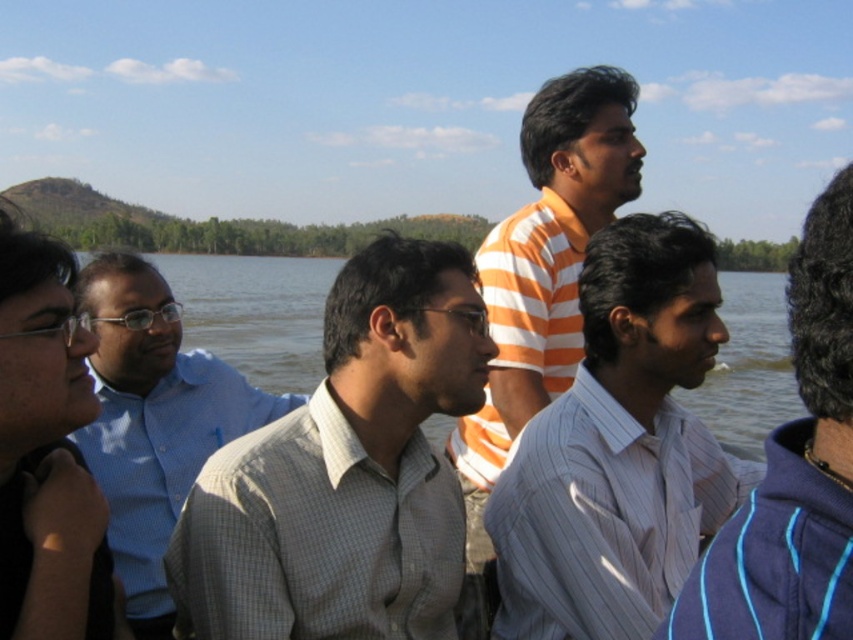
Based on the photo, which is above, white striped shirt at center or blue water at center?

Positioned higher is blue water at center.

Which of these two, white striped shirt at center or blue water at center, stands shorter?

white striped shirt at center is shorter.

The width and height of the screenshot is (853, 640). Describe the element at coordinates (619, 449) in the screenshot. I see `white striped shirt at center` at that location.

Where is `white striped shirt at center`? This screenshot has height=640, width=853. white striped shirt at center is located at coordinates (619, 449).

Who is positioned more to the left, striped cotton shirt at right or blue checkered shirt at left?

blue checkered shirt at left is more to the left.

Is point (834, 312) farther from viewer compared to point (128, 602)?

No, (834, 312) is closer to viewer.

Does point (804, 506) come farther from viewer compared to point (144, 268)?

No, it is not.

The width and height of the screenshot is (853, 640). Find the location of `striped cotton shirt at right`. striped cotton shirt at right is located at coordinates (793, 470).

Who is more distant from viewer, (633, 490) or (480, 497)?

Point (480, 497)

Identify the location of white striped shirt at center. The width and height of the screenshot is (853, 640). (619, 449).

Find the location of a particular element. Image resolution: width=853 pixels, height=640 pixels. white striped shirt at center is located at coordinates (619, 449).

The image size is (853, 640). I want to click on white striped shirt at center, so click(619, 449).